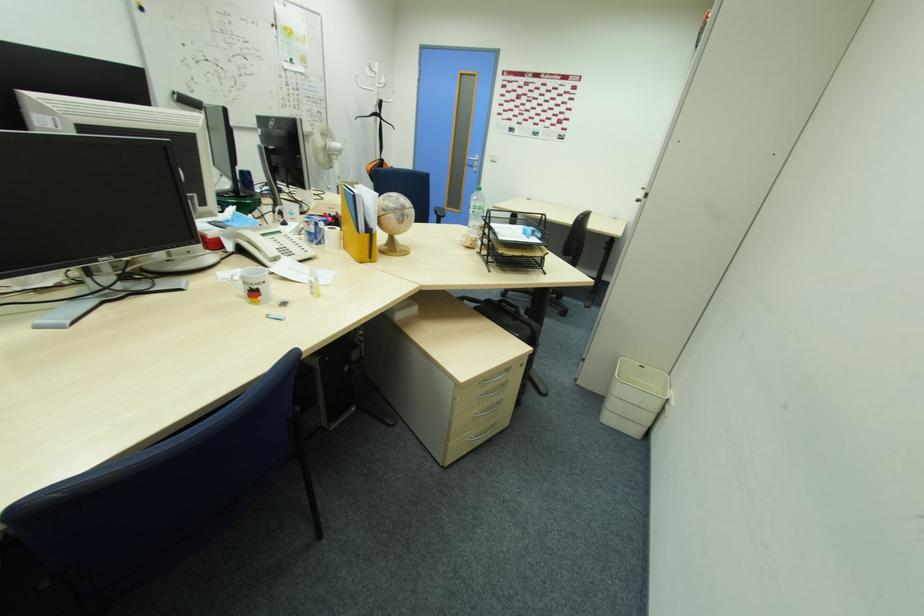
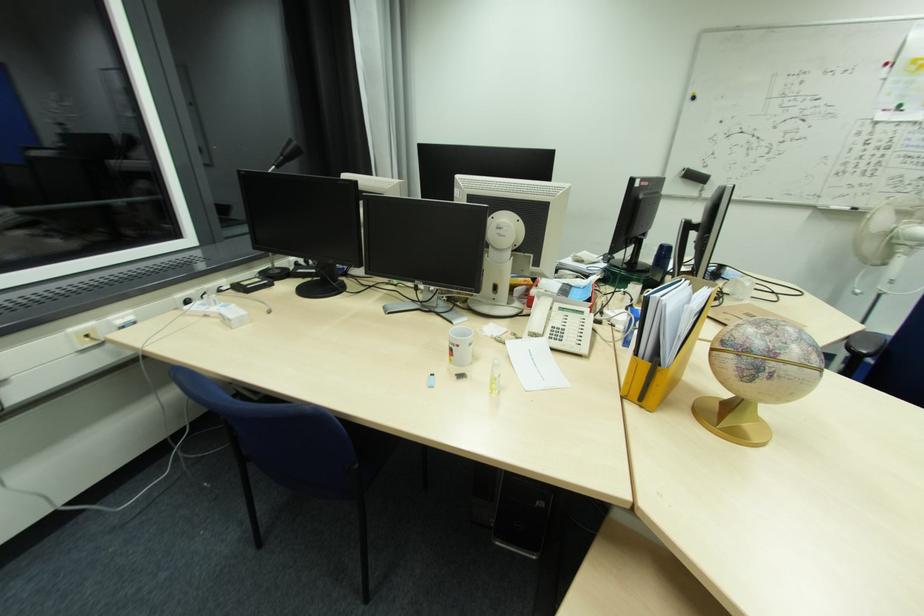
Question: Based on the continuous images, in which direction is the camera rotating? Reply with the corresponding letter.

Choices:
 (A) Left
 (B) Right
 (C) Up
 (D) Down

Answer: (A)